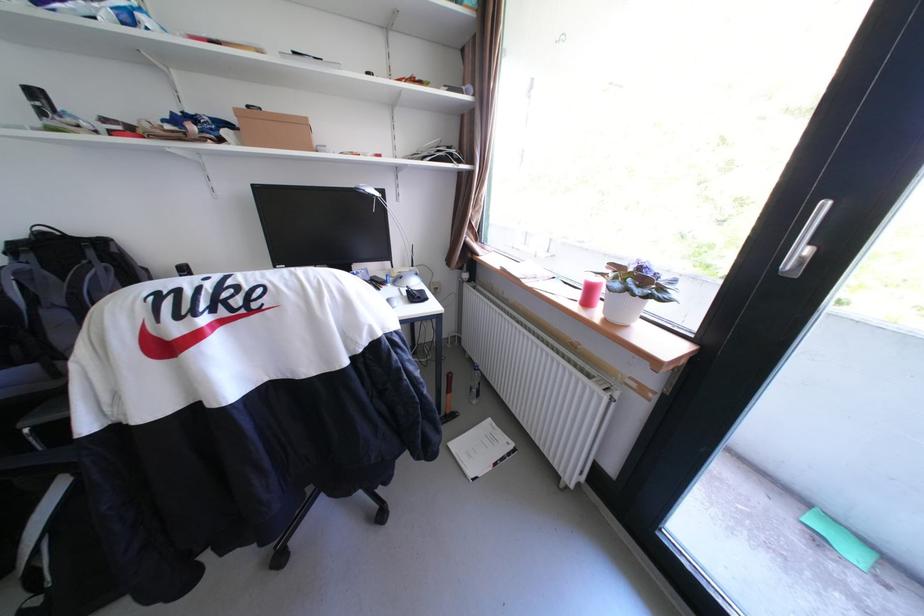
Locate an element on the screen. hammer is located at coordinates (447, 391).